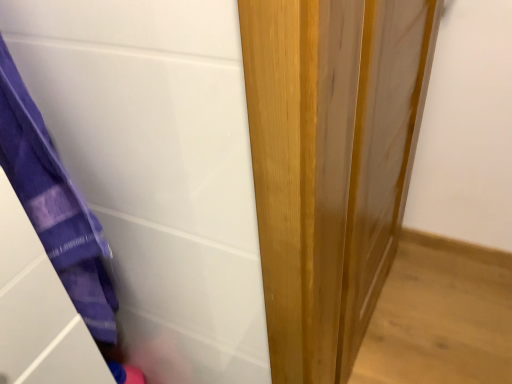
Question: Is purple fabric at left wider or thinner than wooden door at center?

Choices:
 (A) thin
 (B) wide

Answer: (B)

Question: Is purple fabric at left taller or shorter than wooden door at center?

Choices:
 (A) tall
 (B) short

Answer: (B)

Question: Is point (179, 264) closer or farther from the camera than point (326, 147)?

Choices:
 (A) closer
 (B) farther

Answer: (B)

Question: Is wooden door at center to the left or to the right of purple fabric at left in the image?

Choices:
 (A) left
 (B) right

Answer: (B)

Question: From the image's perspective, is wooden door at center above or below purple fabric at left?

Choices:
 (A) above
 (B) below

Answer: (A)

Question: In terms of width, does wooden door at center look wider or thinner when compared to purple fabric at left?

Choices:
 (A) thin
 (B) wide

Answer: (A)

Question: In the image, is wooden door at center positioned in front of or behind purple fabric at left?

Choices:
 (A) front
 (B) behind

Answer: (B)